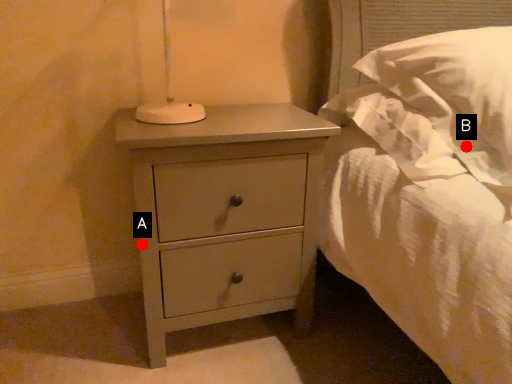
Question: Two points are circled on the image, labeled by A and B beside each circle. Which point is closer to the camera taking this photo?

Choices:
 (A) A is closer
 (B) B is closer

Answer: (B)